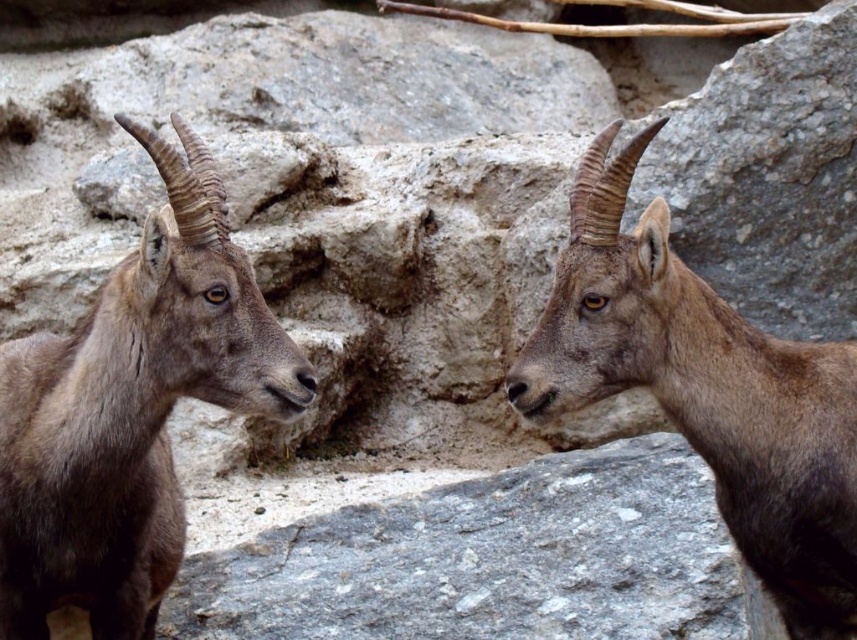
Question: Is brown woolen goat at left smaller than brown woolen goat at center?

Choices:
 (A) no
 (B) yes

Answer: (A)

Question: Which object appears closest to the camera in this image?

Choices:
 (A) brown woolen goat at left
 (B) brown woolen goat at center

Answer: (A)

Question: Which of the following is the farthest from the observer?

Choices:
 (A) brown woolen goat at center
 (B) brown woolen goat at left

Answer: (A)

Question: Is brown woolen goat at left positioned before brown woolen goat at center?

Choices:
 (A) yes
 (B) no

Answer: (A)

Question: Does brown woolen goat at left have a larger size compared to brown woolen goat at center?

Choices:
 (A) no
 (B) yes

Answer: (B)